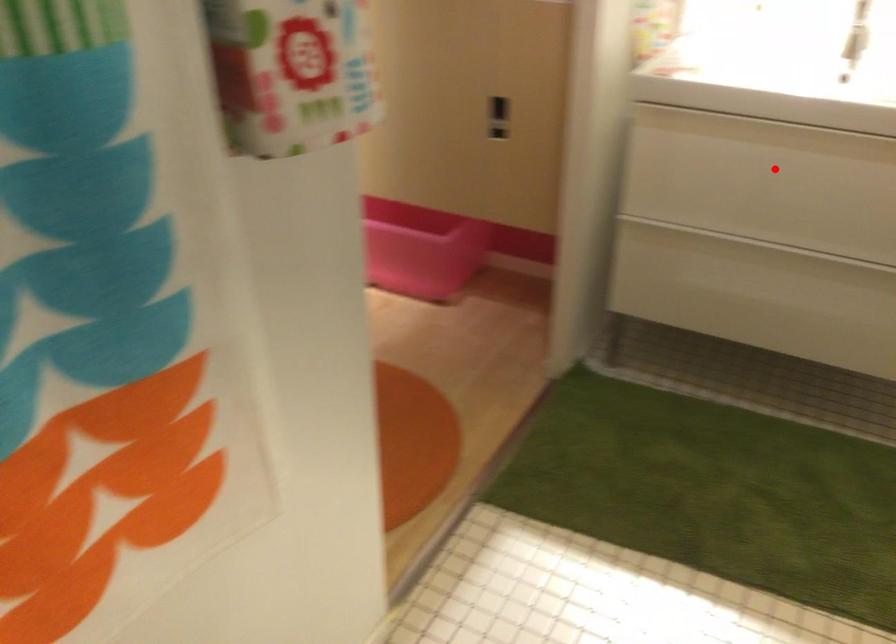
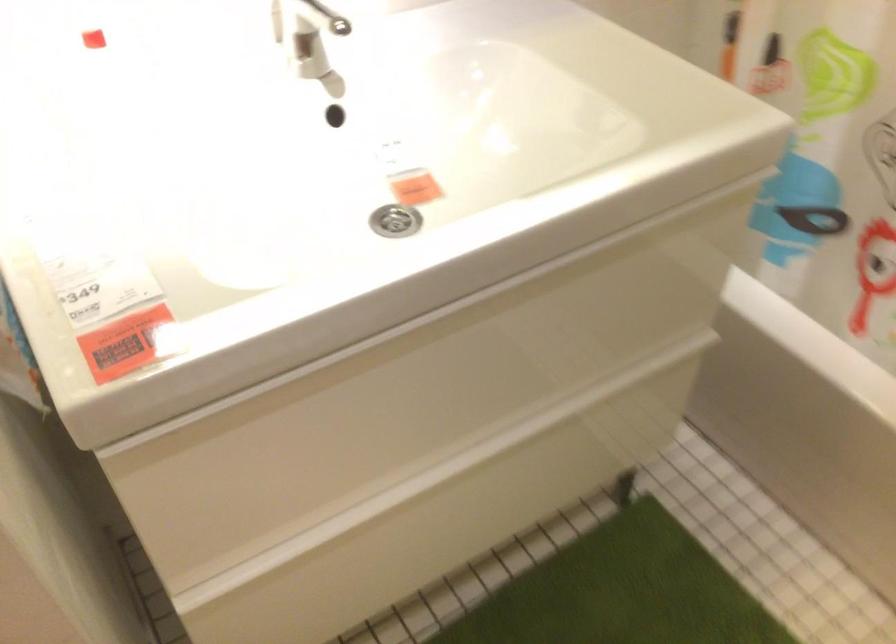
Locate, in the second image, the point that corresponds to the highlighted location in the first image.

(423, 392)